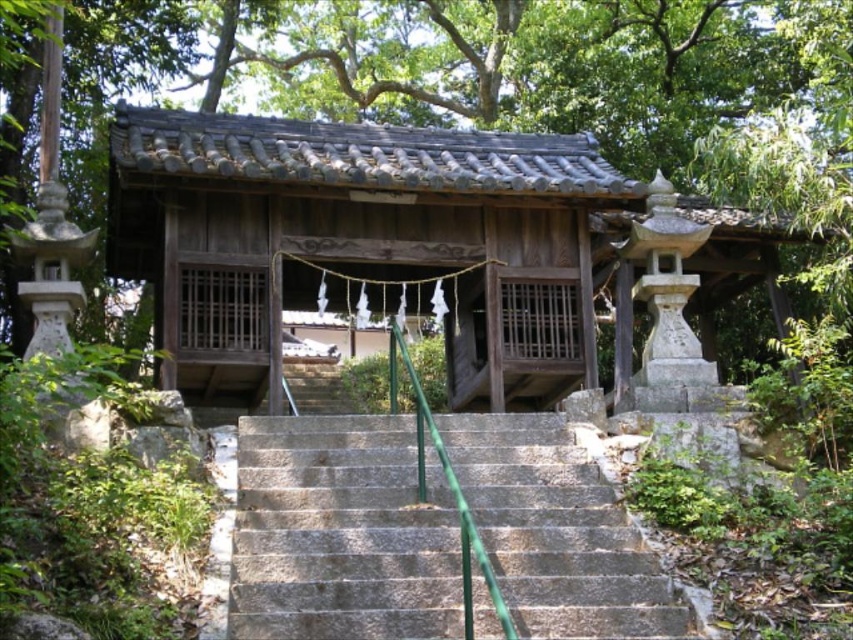
Measure the distance between gray stone stairs at center and green metallic handrail at center.

gray stone stairs at center is 10.28 feet away from green metallic handrail at center.

You are a GUI agent. You are given a task and a screenshot of the screen. Output one action in this format:
    pyautogui.click(x=<x>, y=<y>)
    Task: Click on the gray stone stairs at center
    Image resolution: width=853 pixels, height=640 pixels.
    Given the screenshot: What is the action you would take?
    pyautogui.click(x=341, y=532)

Find the location of a particular element. The width and height of the screenshot is (853, 640). gray stone stairs at center is located at coordinates (341, 532).